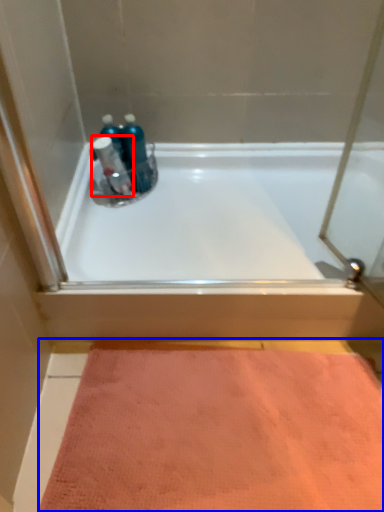
Question: Which of the following is the farthest to the observer, cleaning product (highlighted by a red box) or doormat (highlighted by a blue box)?

Choices:
 (A) cleaning product
 (B) doormat

Answer: (A)